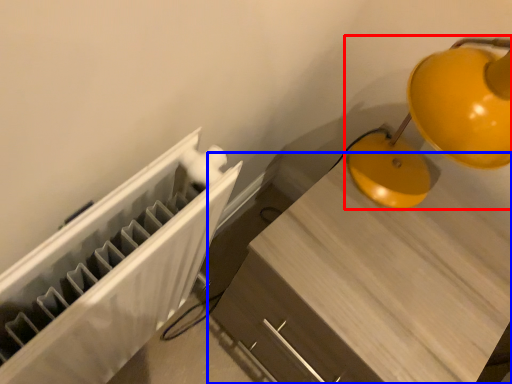
Question: Which point is closer to the camera, lamp (highlighted by a red box) or furniture (highlighted by a blue box)?

Choices:
 (A) lamp
 (B) furniture

Answer: (A)